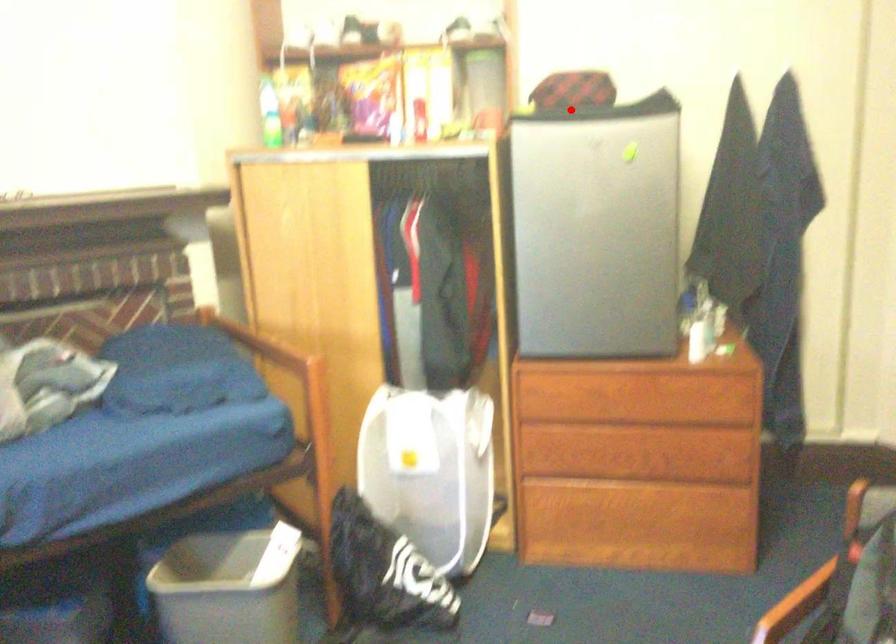
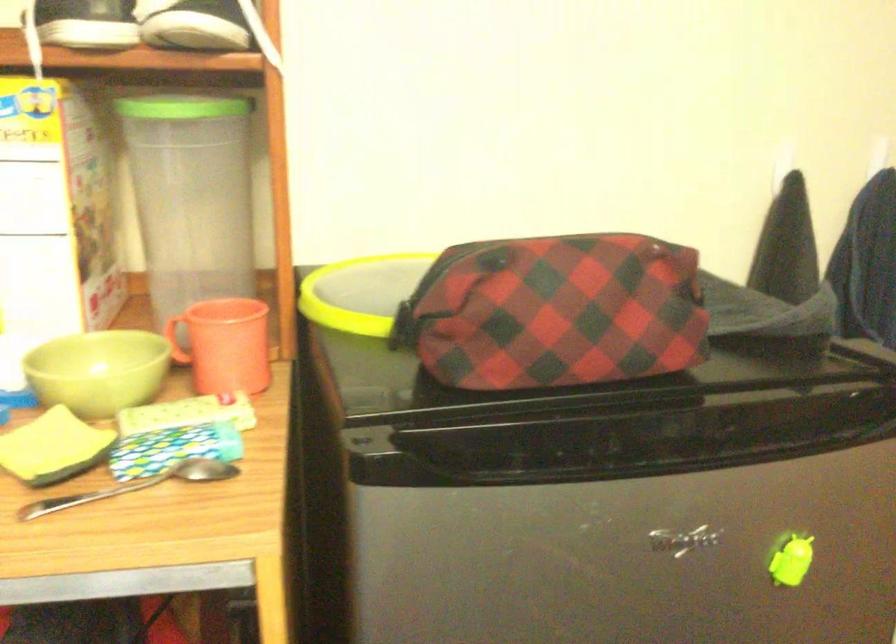
Question: I am providing you with two images of the same scene from different viewpoints. Given a red point in image1, look at the same physical point in image2. Is it:

Choices:
 (A) Closer to the viewpoint
 (B) Farther from the viewpoint

Answer: (A)